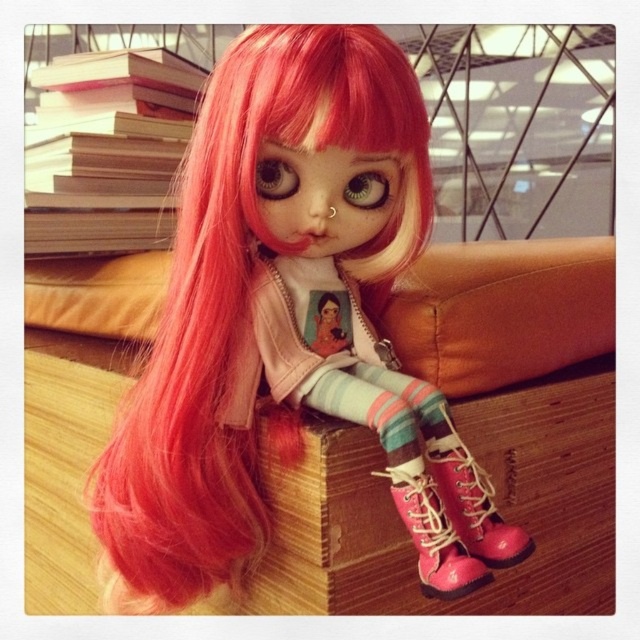
Is pink leather boot at lower right bigger than pink leather boot at lower center?

Correct, pink leather boot at lower right is larger in size than pink leather boot at lower center.

Which is behind, point (464, 540) or point (403, 474)?

Point (464, 540)

This screenshot has height=640, width=640. Find the location of `pink leather boot at lower right`. pink leather boot at lower right is located at coordinates (470, 497).

Can you confirm if pink matte wig at upper left is taller than pink leather boot at lower center?

Yes, pink matte wig at upper left is taller than pink leather boot at lower center.

Is pink matte wig at upper left thinner than pink leather boot at lower center?

No, pink matte wig at upper left is not thinner than pink leather boot at lower center.

Is point (212, 102) in front of point (417, 465)?

No, (212, 102) is further to viewer.

Where is `pink matte wig at upper left`? pink matte wig at upper left is located at coordinates (289, 323).

Does pink matte wig at upper left have a greater height compared to pink leather boot at lower right?

Correct, pink matte wig at upper left is much taller as pink leather boot at lower right.

Image resolution: width=640 pixels, height=640 pixels. Find the location of `pink matte wig at upper left`. pink matte wig at upper left is located at coordinates (289, 323).

Which is behind, point (401, 253) or point (500, 541)?

Point (401, 253)

The image size is (640, 640). I want to click on pink matte wig at upper left, so click(x=289, y=323).